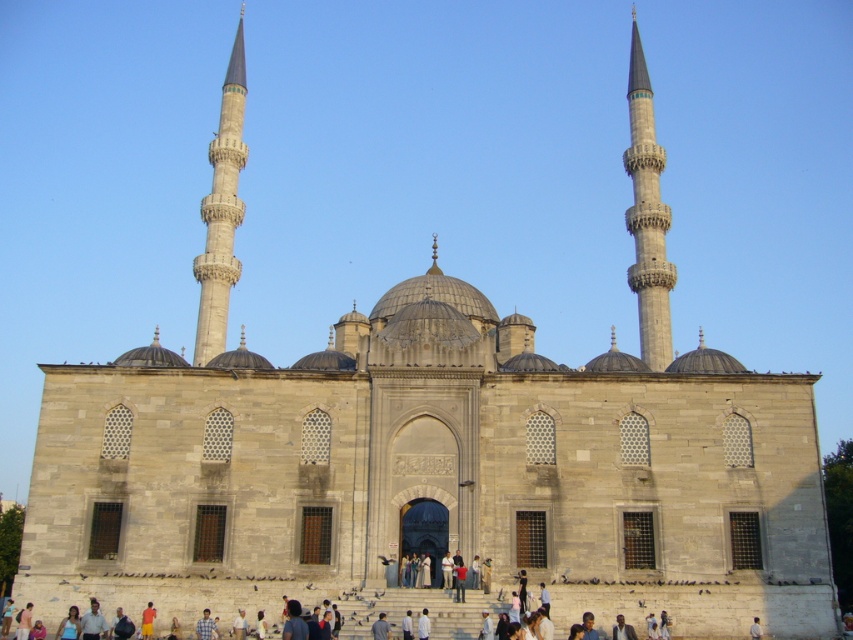
Which is more to the right, gray stone minaret at right or gray stone minaret at left?

gray stone minaret at right

Which is below, gray stone minaret at right or gray stone minaret at left?

gray stone minaret at left

This screenshot has height=640, width=853. I want to click on gray stone minaret at right, so click(x=647, y=216).

You are a GUI agent. You are given a task and a screenshot of the screen. Output one action in this format:
    pyautogui.click(x=<x>, y=<y>)
    Task: Click on the gray stone minaret at right
    The height and width of the screenshot is (640, 853).
    Given the screenshot: What is the action you would take?
    pyautogui.click(x=647, y=216)